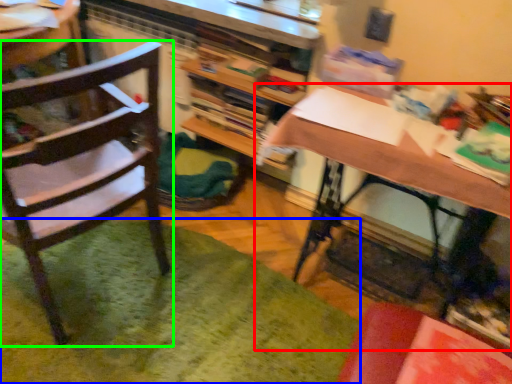
Question: Estimate the real-world distances between objects in this image. Which object is closer to desk (highlighted by a red box), mat (highlighted by a blue box) or chair (highlighted by a green box)?

Choices:
 (A) mat
 (B) chair

Answer: (B)